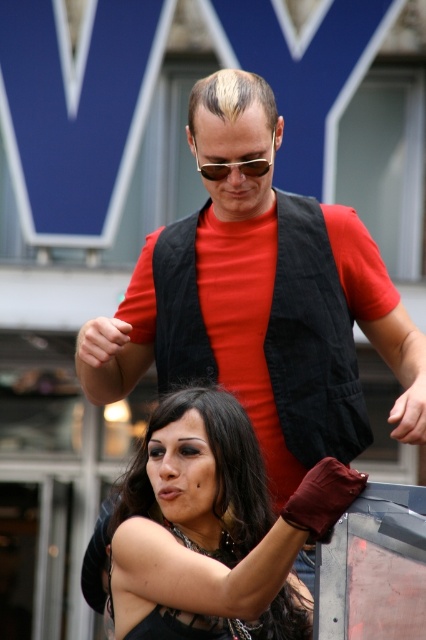
Can you confirm if shiny black hair at lower center is wider than sunglasses at center?

In fact, shiny black hair at lower center might be narrower than sunglasses at center.

Does shiny black hair at lower center appear on the right side of sunglasses at center?

Incorrect, shiny black hair at lower center is not on the right side of sunglasses at center.

Image resolution: width=426 pixels, height=640 pixels. What are the coordinates of `shiny black hair at lower center` in the screenshot? It's located at (213, 529).

You are a GUI agent. You are given a task and a screenshot of the screen. Output one action in this format:
    pyautogui.click(x=<x>, y=<y>)
    Task: Click on the shiny black hair at lower center
    Image resolution: width=426 pixels, height=640 pixels.
    Given the screenshot: What is the action you would take?
    pyautogui.click(x=213, y=529)

Is matte black vest at upper center to the left of shiny black hair at lower center from the viewer's perspective?

Indeed, matte black vest at upper center is positioned on the left side of shiny black hair at lower center.

Is point (339, 337) positioned in front of point (210, 598)?

No.

Who is more forward, (321, 352) or (336, 461)?

Point (336, 461) is more forward.

Find the location of a particular element. This screenshot has width=426, height=640. matte black vest at upper center is located at coordinates (264, 323).

Does point (282, 340) come in front of point (244, 164)?

No, it is behind (244, 164).

Is matte black vest at upper center thinner than sunglasses at center?

Indeed, matte black vest at upper center has a lesser width compared to sunglasses at center.

At what (x,y) coordinates should I click in order to perform the action: click on matte black vest at upper center. Please return your answer as a coordinate pair (x, y). The height and width of the screenshot is (640, 426). Looking at the image, I should click on (264, 323).

At what (x,y) coordinates should I click in order to perform the action: click on matte black vest at upper center. Please return your answer as a coordinate pair (x, y). Looking at the image, I should click on (264, 323).